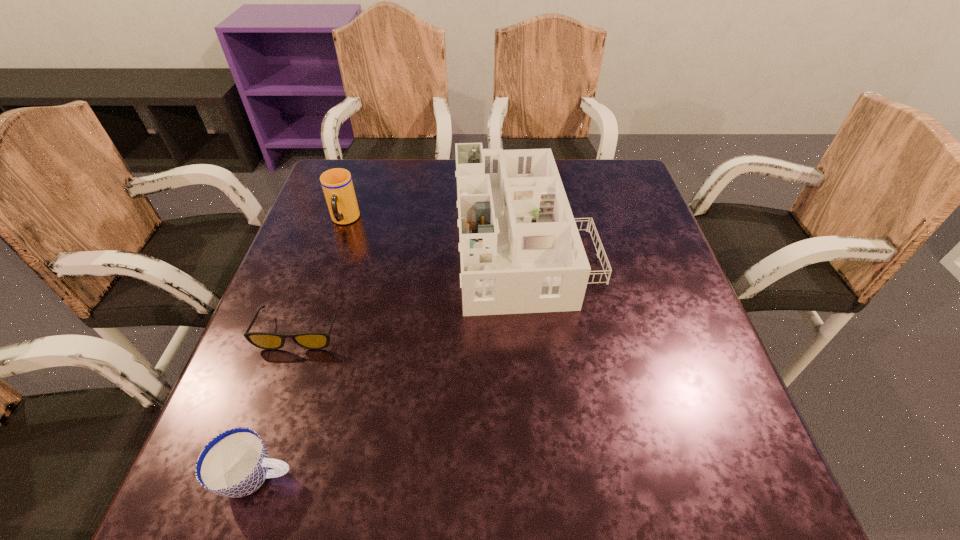
At what (x,y) coordinates should I click in order to perform the action: click on the rightmost object. Please return your answer as a coordinate pair (x, y). This screenshot has width=960, height=540. Looking at the image, I should click on (520, 250).

The height and width of the screenshot is (540, 960). Identify the location of the taller cup. (337, 185).

Locate an element on the screen. the second shortest object is located at coordinates tap(235, 463).

Where is `the nearest object`? The width and height of the screenshot is (960, 540). the nearest object is located at coordinates (235, 463).

At what (x,y) coordinates should I click in order to perform the action: click on the shortest object. Please return your answer as a coordinate pair (x, y). This screenshot has width=960, height=540. Looking at the image, I should click on (309, 340).

Where is `blank space located on the left of the dollhouse`? Image resolution: width=960 pixels, height=540 pixels. blank space located on the left of the dollhouse is located at coordinates (327, 239).

Find the location of a particular element. vacant space situated 0.380m on the side of the farther cup with the handle is located at coordinates (296, 364).

Identify the location of free region located 0.050m on the side of the shorter cup with the handle. The height and width of the screenshot is (540, 960). (327, 476).

The height and width of the screenshot is (540, 960). I want to click on vacant point located 0.230m on the front-facing side of the sunglasses, so click(x=251, y=471).

The height and width of the screenshot is (540, 960). Identify the location of object that is at the far edge. (520, 250).